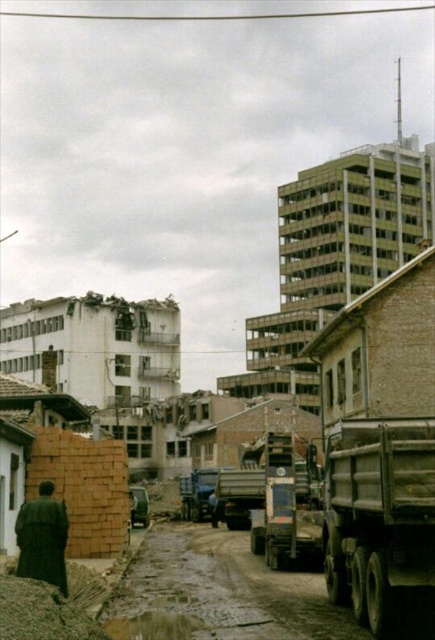
Is gray metallic truck at lower right to the right of matte blue truck at center from the viewer's perspective?

Yes, gray metallic truck at lower right is to the right of matte blue truck at center.

The height and width of the screenshot is (640, 435). What are the coordinates of `gray metallic truck at lower right` in the screenshot? It's located at (378, 515).

Is metallic gray truck at center to the left of brown clay mud at lower left from the viewer's perspective?

In fact, metallic gray truck at center is to the right of brown clay mud at lower left.

Which is more to the left, metallic gray truck at center or brown clay mud at lower left?

brown clay mud at lower left

Describe the element at coordinates (277, 500) in the screenshot. I see `metallic gray truck at center` at that location.

Find the location of a particular element. The width and height of the screenshot is (435, 640). metallic gray truck at center is located at coordinates (277, 500).

Does gray metallic truck at lower right have a greater height compared to brown clay mud at lower left?

Yes.

Does point (421, 444) come in front of point (50, 611)?

No, (421, 444) is further to viewer.

Where is `gray metallic truck at lower right`? gray metallic truck at lower right is located at coordinates pyautogui.click(x=378, y=515).